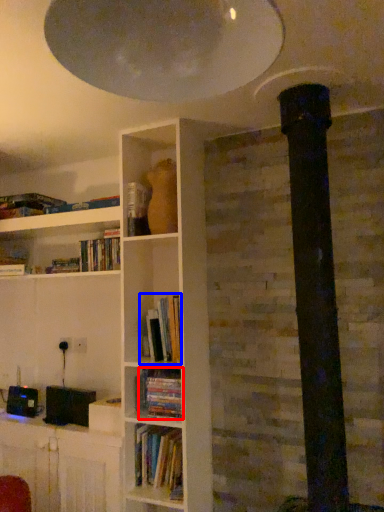
Question: Which object is further to the camera taking this photo, book (highlighted by a red box) or book (highlighted by a blue box)?

Choices:
 (A) book
 (B) book

Answer: (B)